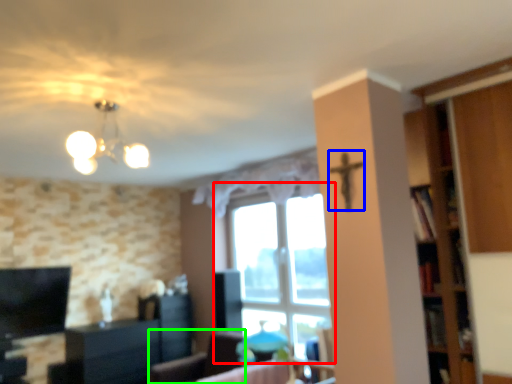
Question: Which object is the farthest from window (highlighted by a red box)? Choose among these: crucifix (highlighted by a blue box) or furniture (highlighted by a green box).

Choices:
 (A) crucifix
 (B) furniture

Answer: (A)